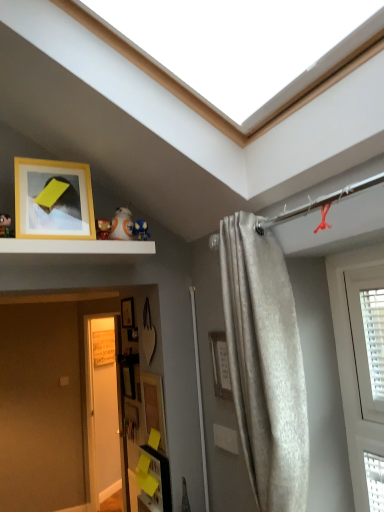
Question: Considering their positions, is white glossy bb8 droid at upper center, which ranks as the 2th toy in right-to-left order, located in front of or behind white matte shelf at upper center?

Choices:
 (A) front
 (B) behind

Answer: (B)

Question: In the image, is white glossy bb8 droid at upper center, the 3th toy when ordered from front to back, on the left side or the right side of white matte shelf at upper center?

Choices:
 (A) left
 (B) right

Answer: (B)

Question: Estimate the real-world distances between objects in this image. Which object is farther from the white glossy door at lower left?

Choices:
 (A) matte blue plush at upper center, the 1th toy from the right
 (B) matte plastic toy at upper center, arranged as the second toy when viewed from the front
 (C) yellow matte picture frame at upper left, the first picture frame in the top-to-bottom sequence
 (D) white glossy bb8 droid at upper center, the 3th toy when ordered from front to back
 (E) wooden picture frame at center, placed as the fourth picture frame when sorted from front to back

Answer: (B)

Question: Based on their relative distances, which object is farther from the matte blue plush at upper center, the fourth toy from the left?

Choices:
 (A) white glossy door at lower left
 (B) white glossy bb8 droid at upper center, the 2th toy viewed from the back
 (C) matte black toy at upper left, which is the 1th toy from front to back
 (D) satin beige curtain at right
 (E) wooden picture frame at center, which ranks as the 2th picture frame in top-to-bottom order

Answer: (A)